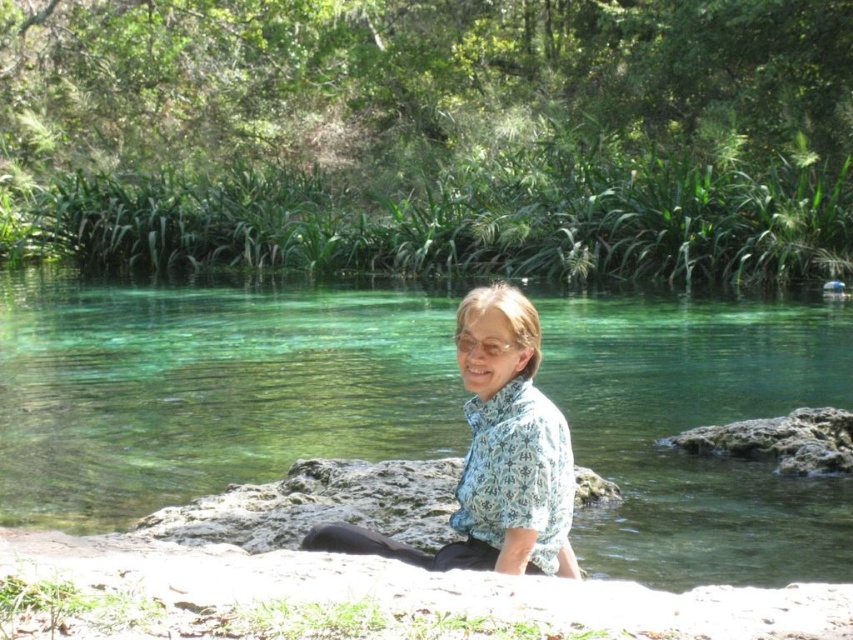
You are a photographer wanting to capture the clear water at center and the blue floral shirt at center in a single shot. Since the camera can only focus on one subject at a time, which one should you focus on to ensure the other is still in the frame?

The clear water at center is positioned on the left side of blue floral shirt at center, so focusing on the blue floral shirt at center would keep the clear water at center within the frame as it is to the left.

You are planning to take a photo of the clear water at center and the blue floral shirt at center. Which object should you focus on first if you want to capture both in a single frame without moving the camera? Explain your reasoning based on their sizes.

You should focus on the clear water at center first because its width is greater than the blue floral shirt at center, making it the larger object in the scene. By focusing on the larger object first, you can ensure that both objects fit within the frame more effectively.